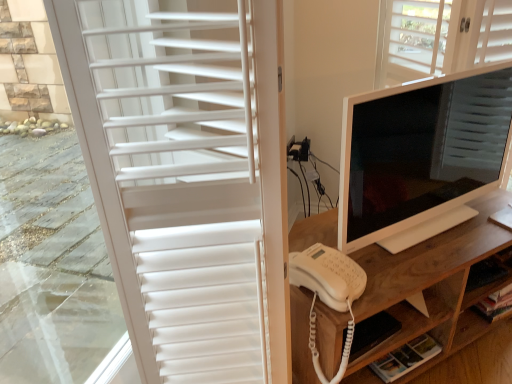
Question: Visually, is white matte shutter at left positioned to the left or to the right of white plastic telephone at center?

Choices:
 (A) left
 (B) right

Answer: (A)

Question: From the image's perspective, is white matte shutter at left above or below white plastic telephone at center?

Choices:
 (A) below
 (B) above

Answer: (B)

Question: Based on their relative distances, which object is nearer to the white plastic telephone at center?

Choices:
 (A) white glossy monitor at center
 (B) white wood shelf at lower right
 (C) wooden desk at center
 (D) white matte shutter at left

Answer: (C)

Question: Estimate the real-world distances between objects in this image. Which object is closer to the white plastic telephone at center?

Choices:
 (A) white matte shutter at left
 (B) white wood shelf at lower right
 (C) white glossy monitor at center
 (D) wooden desk at center

Answer: (D)